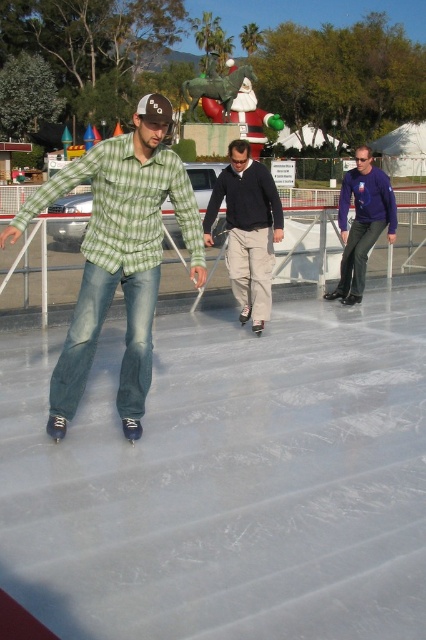
You are standing at the edge of the ice rink and see the green plaid shirt at center and the dark blue sweater at center. Which one is closer to you?

The green plaid shirt at center is below the dark blue sweater at center, so the green plaid shirt at center is closer to you.

You are an observer standing at the edge of the ice rink. You see two people skating in the center area wearing the dark blue sweater at center and the matte purple sweater at center. Which one is positioned to the left of the other?

The dark blue sweater at center is positioned on the left side of matte purple sweater at center.